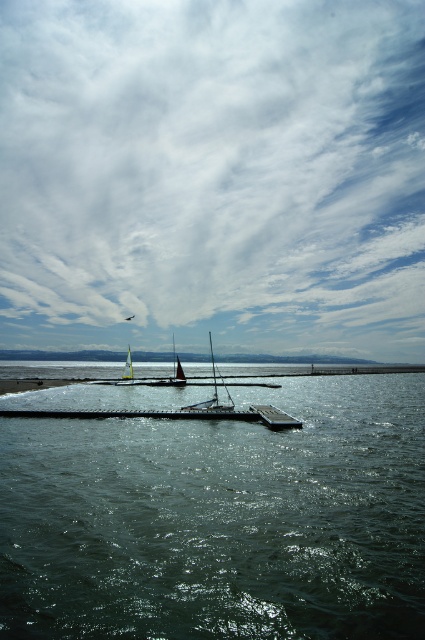
You are a photographer trying to capture both the white glossy sailboat at center and the red sailboat at center in a single shot. Based on their positions, which boat should you adjust your camera to focus on first to ensure both are in frame?

You should focus on the white glossy sailboat at center first since it is positioned to the right of the red sailboat at center, allowing you to adjust the camera angle to include both boats in the frame.

You are a photographer trying to capture a clear shot of the white glossy sailboat at center without any obstructions. Based on the scene, will the white fluffy cloud at upper center block the sailboat in your photo?

The white fluffy cloud at upper center is located above the white glossy sailboat at center, so it will not block the sailboat in your photo since it is positioned higher in the frame.

You are a photographer planning to capture the white fluffy cloud at upper center and the metallic gray dock at center in a single shot. Given that your camera has a limited field of view, can you fit both objects into the frame without moving the camera?

The white fluffy cloud at upper center is wider than the metallic gray dock at center, so it might be challenging to fit both into the camera frame without moving the camera, as the cloud requires more horizontal space.